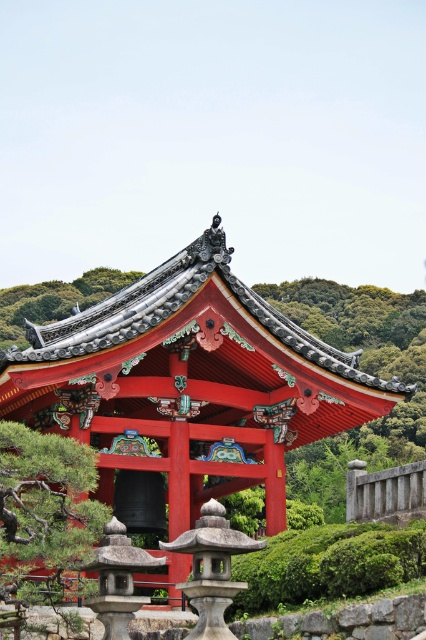
Can you confirm if green textured pine tree at center is taller than green leafy tree at upper left?

No.

Is point (55, 456) less distant than point (14, 317)?

Yes.

The image size is (426, 640). What are the coordinates of `green textured pine tree at center` in the screenshot? It's located at (43, 509).